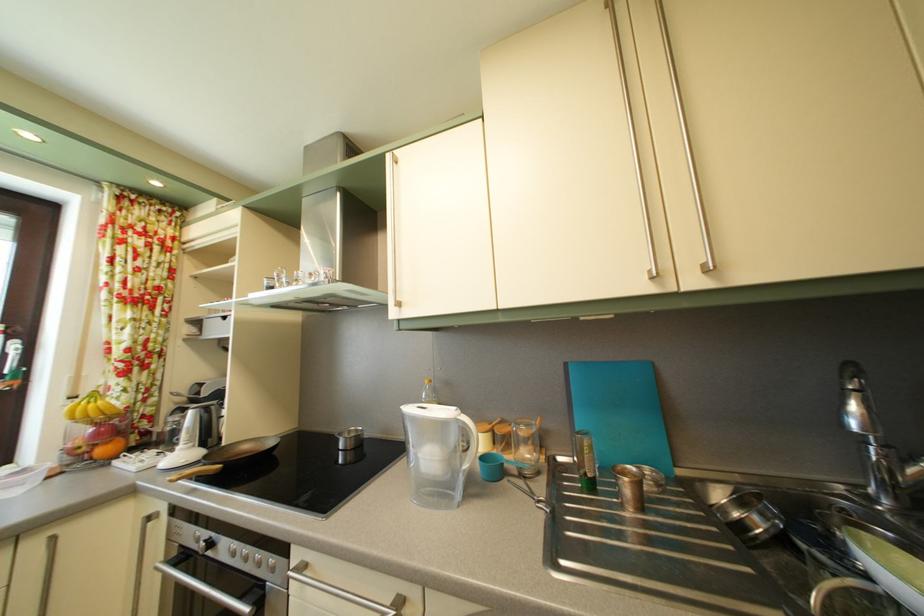
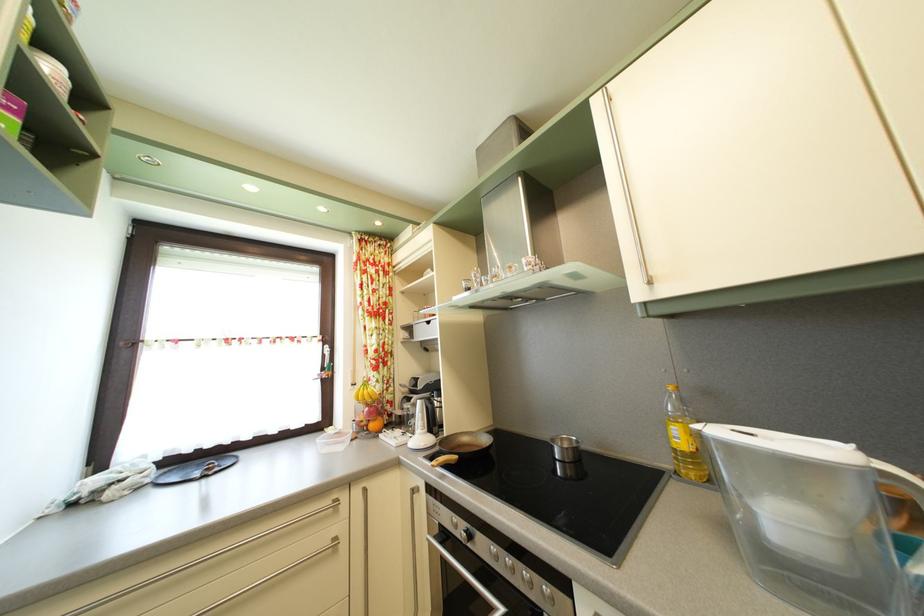
Locate, in the second image, the point that corresponds to [261,568] in the first image.

(529, 584)